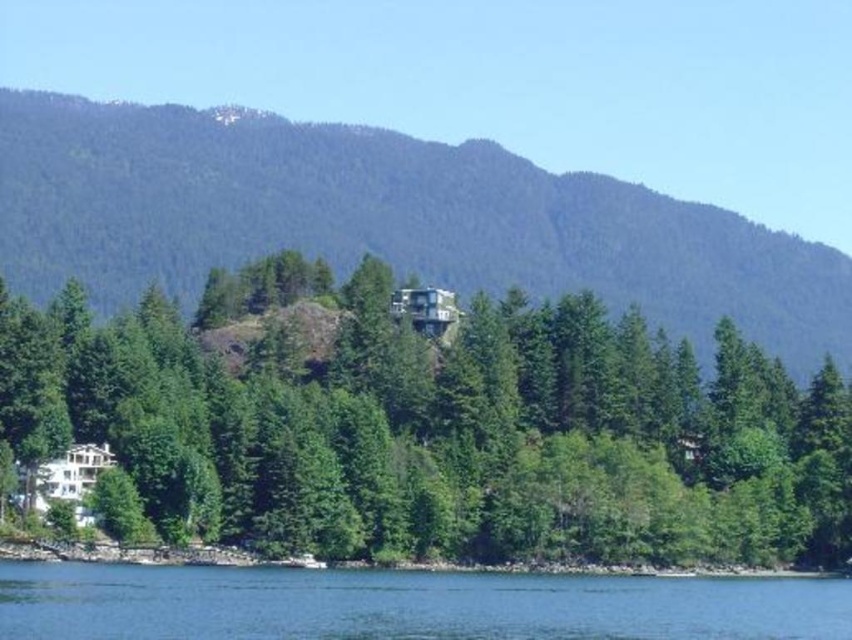
Based on the scene described, what can be found at the coordinate point labeled as point [384,220]?

At point [384,220] lies green forested mountain at center.

You are standing at the edge of the forest looking towards the mountain. You see the green matte tree at center and the blue water at lower center. Which object is closer to you?

The green matte tree at center is closer to you because the blue water at lower center is behind it.

You are a hiker planning to take a photo of the green forested mountain at center and the blue water at lower center. From which object should you stand closer to frame both in your camera viewfinder?

To frame both the green forested mountain at center and the blue water at lower center in your camera viewfinder, you should stand closer to the blue water at lower center since the green forested mountain at center is positioned over it, making them naturally aligned when closer to the water.